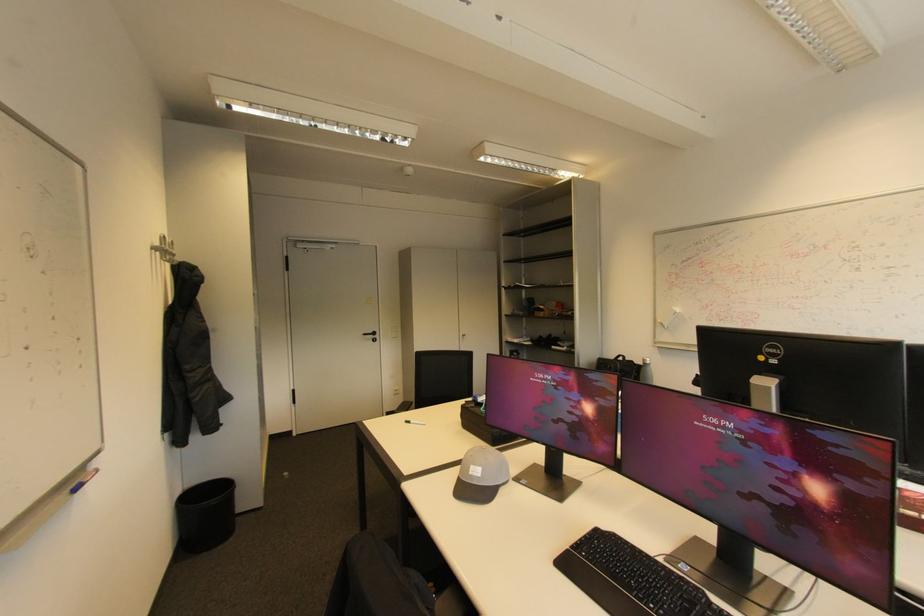
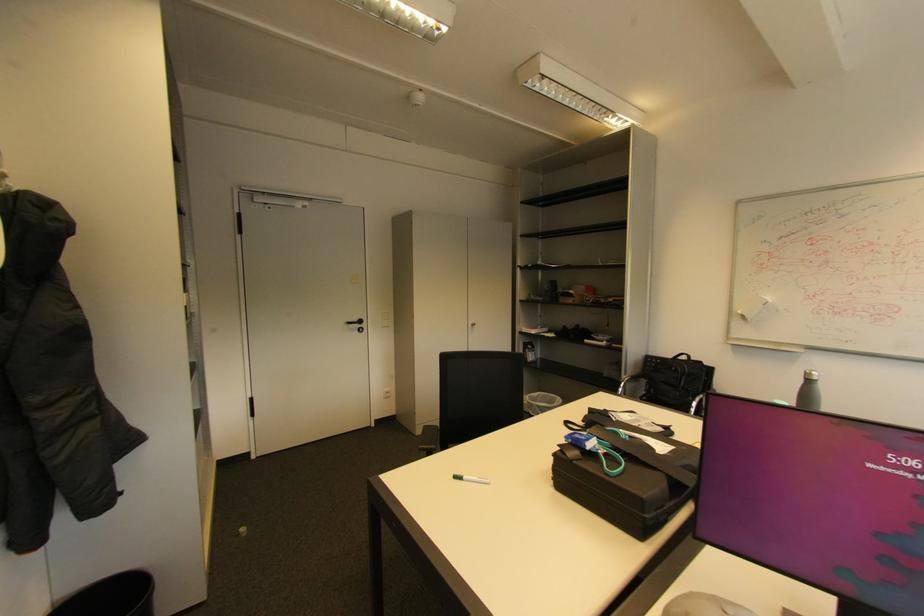
Find the pixel in the second image that matches (614,367) in the first image.

(678, 369)